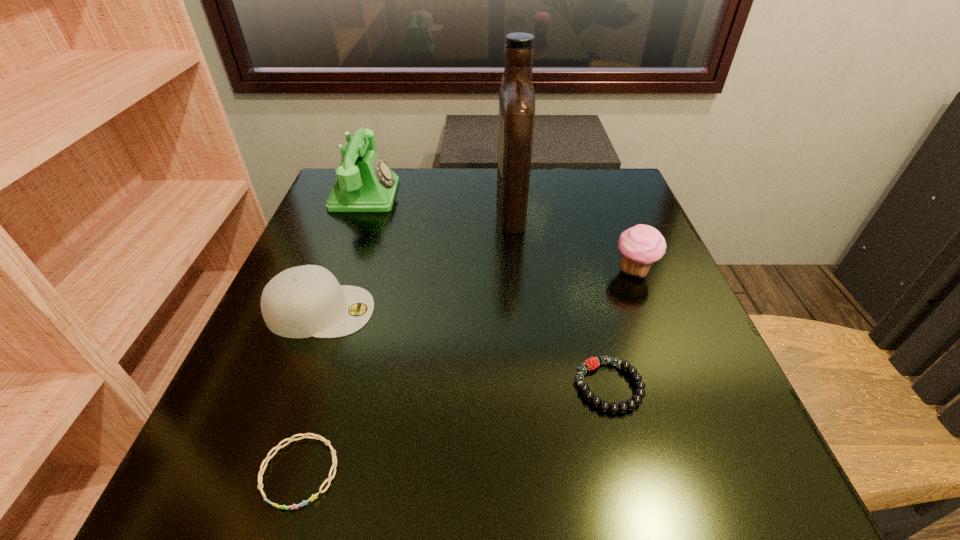
The height and width of the screenshot is (540, 960). I want to click on vacant position at the left edge of the desktop, so click(x=262, y=341).

The height and width of the screenshot is (540, 960). In the image, there is a desktop. Identify the location of vacant area at the right edge. (680, 410).

In the image, there is a desktop. Identify the location of blank space at the near left corner. The height and width of the screenshot is (540, 960). (183, 488).

Find the location of `vacant position at the far right corner of the desktop`. vacant position at the far right corner of the desktop is located at coordinates (599, 208).

Find the location of a particular element. This screenshot has height=540, width=960. free spot at the near right corner of the desktop is located at coordinates (741, 471).

I want to click on free space between the nearer bracelet and the rightmost object, so click(467, 371).

This screenshot has width=960, height=540. In order to click on vacant region between the right bracelet and the liquor in this screenshot , I will do `click(560, 296)`.

Find the location of a particular element. The height and width of the screenshot is (540, 960). blank region between the third object from right to left and the third tallest object is located at coordinates (573, 238).

Locate an element on the screen. free space between the shortest object and the taller bracelet is located at coordinates (454, 429).

Where is `vacant space that is in between the fourth farthest object and the liquor`? This screenshot has height=540, width=960. vacant space that is in between the fourth farthest object and the liquor is located at coordinates (416, 258).